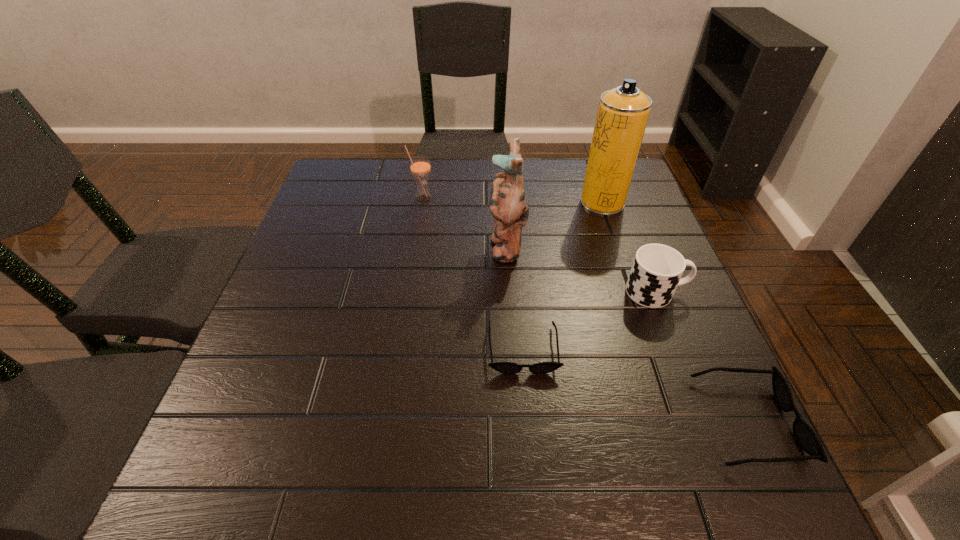
In the current image, all sunglassess are evenly spaced. To maintain this equal spacing, where should an additional sunglasses be placed on the left? Please point out a free spot. Please provide its 2D coordinates. Your answer should be formatted as a tuple, i.e. [(x, y)], where the tuple contains the x and y coordinates of a point satisfying the conditions above.

[(348, 292)]